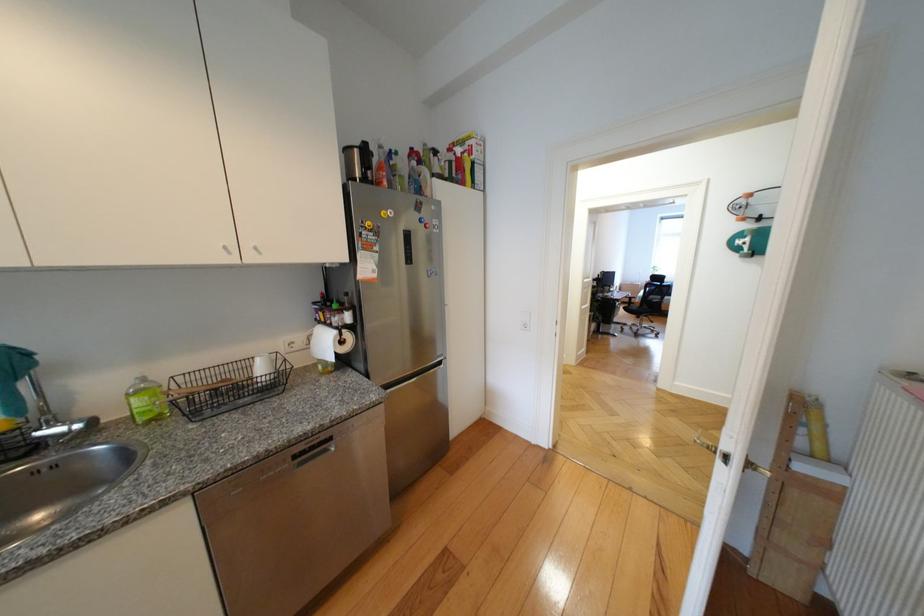
Describe the element at coordinates (305, 456) in the screenshot. I see `the dishwasher handle` at that location.